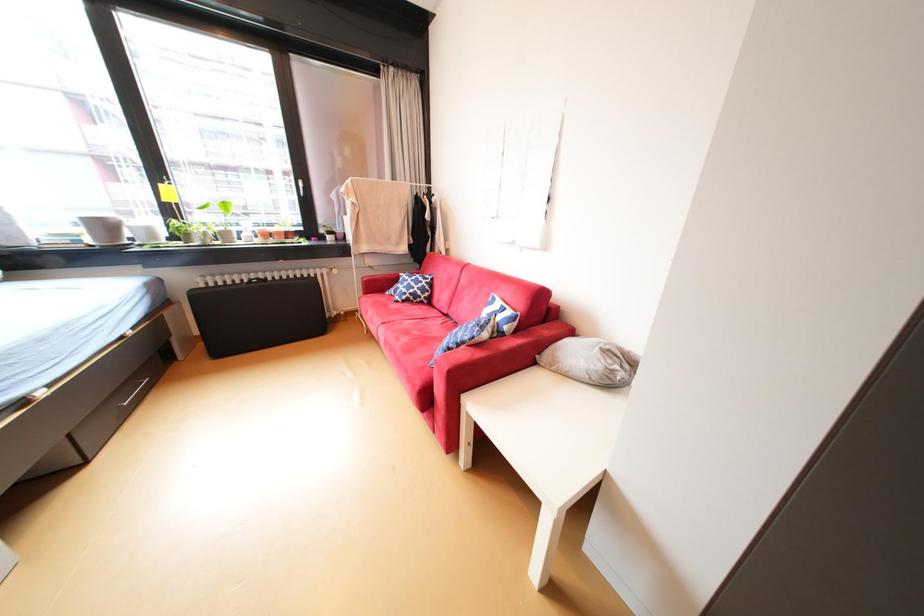
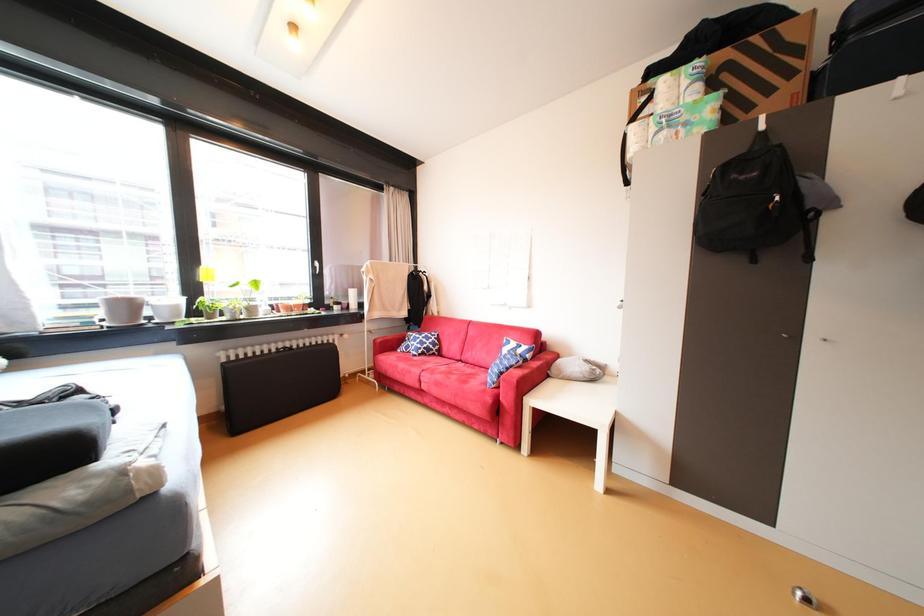
Which direction would the cameraman need to move to produce the second image?

The cameraman moved toward left, backward.